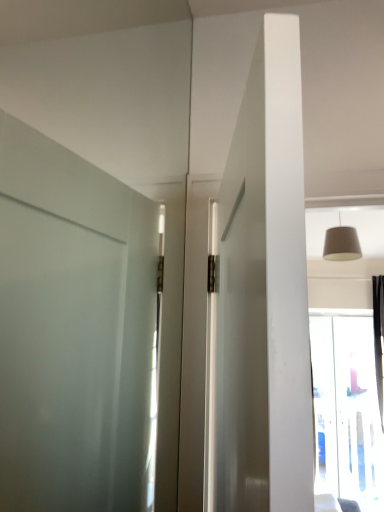
Question: Based on their positions, is transparent glass window at upper right located to the left or right of matte beige lampshade at upper right?

Choices:
 (A) right
 (B) left

Answer: (A)

Question: From a real-world perspective, is transparent glass window at upper right physically located above or below matte beige lampshade at upper right?

Choices:
 (A) above
 (B) below

Answer: (B)

Question: Relative to matte beige lampshade at upper right, is transparent glass window at upper right in front or behind?

Choices:
 (A) behind
 (B) front

Answer: (A)

Question: Considering the positions of matte beige lampshade at upper right and transparent glass window at upper right in the image, is matte beige lampshade at upper right taller or shorter than transparent glass window at upper right?

Choices:
 (A) short
 (B) tall

Answer: (A)

Question: Considering the positions of matte beige lampshade at upper right and transparent glass window at upper right in the image, is matte beige lampshade at upper right wider or thinner than transparent glass window at upper right?

Choices:
 (A) thin
 (B) wide

Answer: (B)

Question: From the image's perspective, is matte beige lampshade at upper right located above or below transparent glass window at upper right?

Choices:
 (A) above
 (B) below

Answer: (A)

Question: Would you say matte beige lampshade at upper right is inside or outside transparent glass window at upper right?

Choices:
 (A) outside
 (B) inside

Answer: (A)